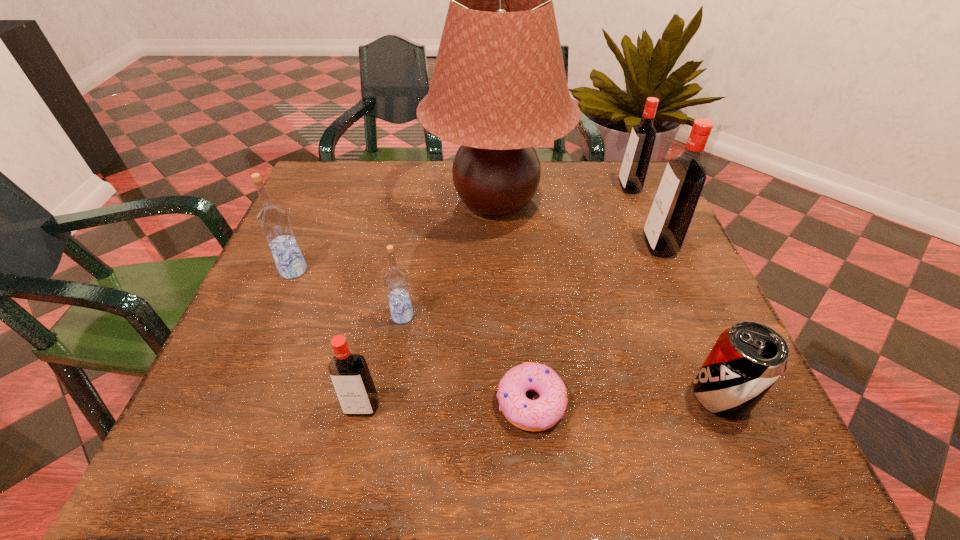
Find the location of a particular element. brown lampshade is located at coordinates click(x=499, y=88).

Locate an element on the screen. Image resolution: width=960 pixels, height=540 pixels. the tallest object is located at coordinates (499, 88).

At what (x,y) coordinates should I click in order to perform the action: click on the biggest red vodka. Please return your answer as a coordinate pair (x, y). The width and height of the screenshot is (960, 540). Looking at the image, I should click on (679, 191).

This screenshot has width=960, height=540. Identify the location of the tallest vodka. (679, 191).

Where is `the second smallest red vodka`? The height and width of the screenshot is (540, 960). the second smallest red vodka is located at coordinates (635, 164).

The image size is (960, 540). In order to click on the farthest vodka in this screenshot , I will do `click(635, 164)`.

Where is `the farther blue vodka`? The height and width of the screenshot is (540, 960). the farther blue vodka is located at coordinates point(274,222).

Where is `the bigger blue vodka`? This screenshot has height=540, width=960. the bigger blue vodka is located at coordinates (274, 222).

The image size is (960, 540). I want to click on the nearest red vodka, so click(351, 378).

Where is `the leftmost red vodka`? the leftmost red vodka is located at coordinates (351, 378).